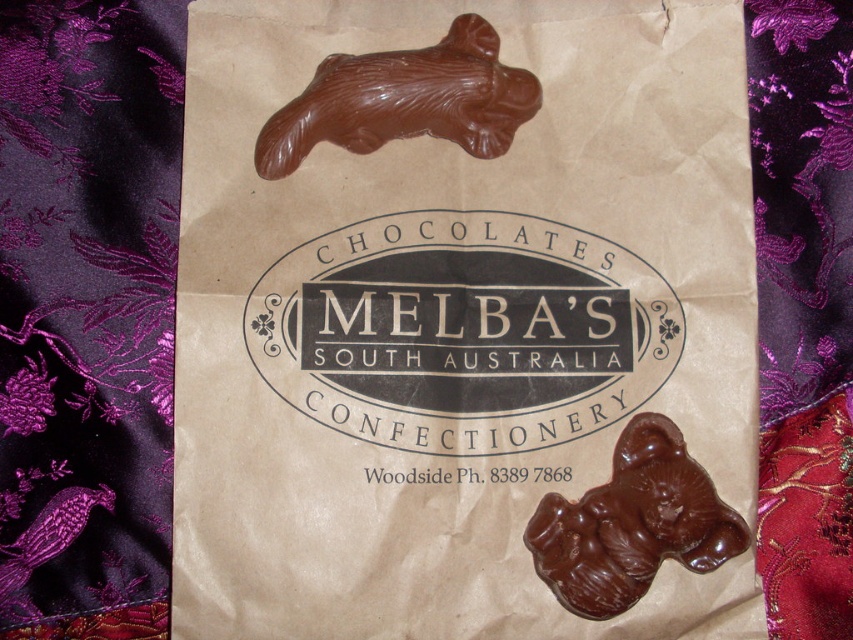
You are arranging a gift basket and need to place the purple brocade quilt at left and the shiny dark brown bear at bottom right. Which item should you place first if you want to ensure both fit vertically in the basket?

The purple brocade quilt at left is much taller than the shiny dark brown bear at bottom right, so you should place the purple brocade quilt at left first to ensure there is enough vertical space for both items.

You are organizing a gift basket and need to place the purple brocade quilt at left and the shiny dark brown bear at bottom right. Which item should be placed on the left side of the other?

The purple brocade quilt at left is positioned on the left side of the shiny dark brown bear at bottom right, so the quilt should be placed on the left side of the bear.